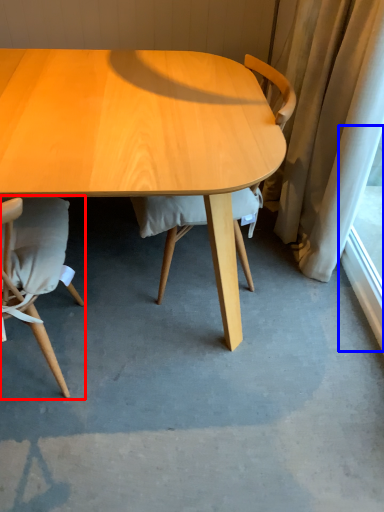
Question: Which object appears farthest to the camera in this image, chair (highlighted by a red box) or window screen (highlighted by a blue box)?

Choices:
 (A) chair
 (B) window screen

Answer: (B)